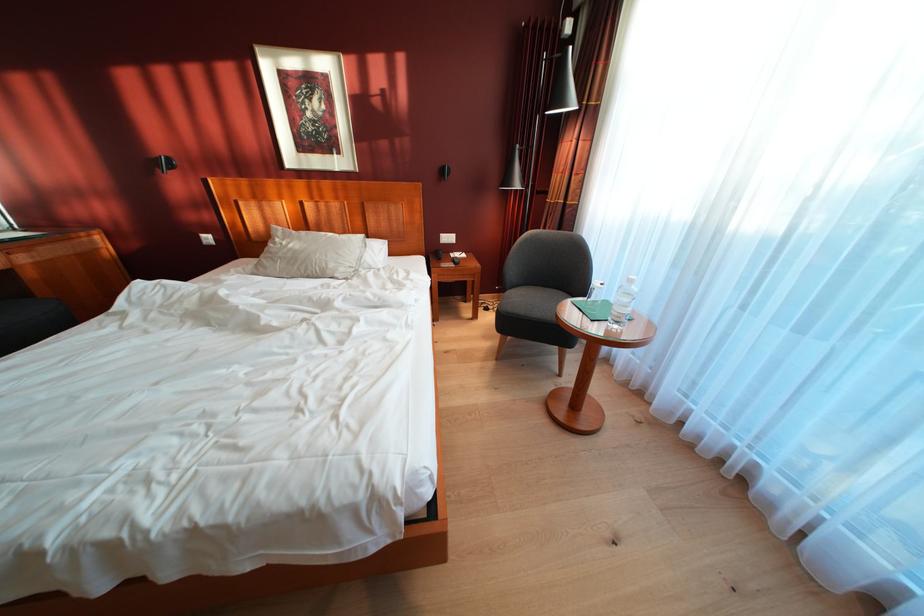
You are a GUI agent. You are given a task and a screenshot of the screen. Output one action in this format:
    pyautogui.click(x=<x>, y=<y>)
    Task: Click on the grey chair sitting surface
    Image resolution: width=924 pixels, height=616 pixels.
    Given the screenshot: What is the action you would take?
    pyautogui.click(x=535, y=300)